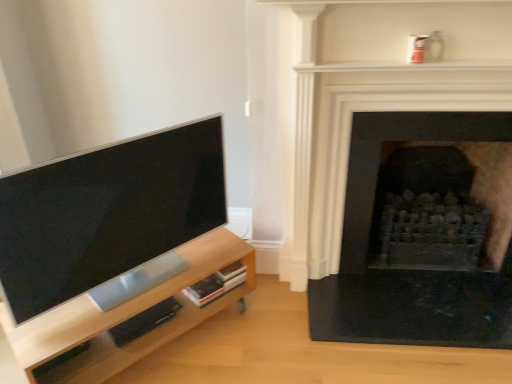
Where is `free spot above light wood entertainment center at left (from a real-world perspective)`? free spot above light wood entertainment center at left (from a real-world perspective) is located at coordinates (151, 284).